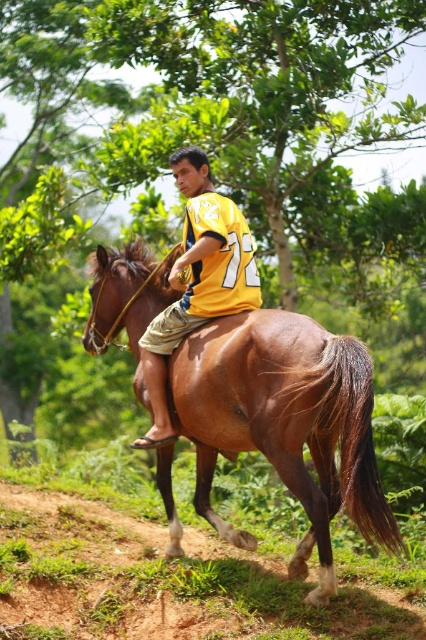
You are a photographer trying to capture the rider and his horse. You have a camera with a fixed lens that can only focus on objects wider than 50 cm. Given that the brown glossy horse at center is wider than the yellow jersey at center, will the horse be in focus?

The brown glossy horse at center is wider than the yellow jersey at center. Since the camera focuses on objects wider than 50 cm, the horse will be in focus if its width exceeds 50 cm. However, the exact width of the horse isn

You are a photographer positioned at the edge of the dirt path. You want to take a photo of the brown glossy horse at center and the yellow jersey at center. If your camera has a minimum focus distance of 80 centimeters, will both subjects be in focus?

The brown glossy horse at center is 81.21 centimeters from the yellow jersey at center. Since the camera requires a minimum focus distance of 80 centimeters, the distance between them is sufficient for both subjects to be in focus.

You are a photographer trying to capture the rider and his horse in the image. Since you want to focus on the rider, which object should you zoom in on more closely, the brown glossy horse at center or the yellow jersey at center?

The yellow jersey at center is taller than the brown glossy horse at center, so you should zoom in more on the yellow jersey at center to focus on the rider.